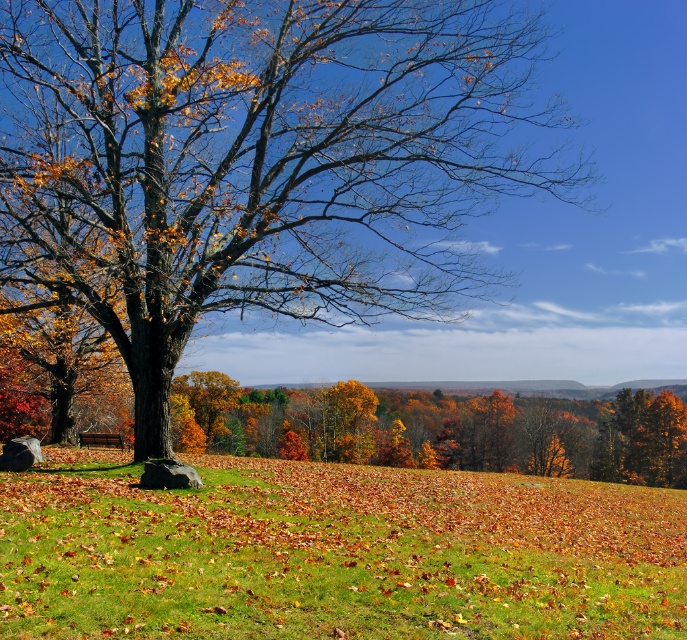
You are planning to set up a picnic in this autumn landscape. You have a picnic blanket that is 2 meters wide. The green grassy field at center is where you want to place it. Considering the matte brown tree at center, will the tree interfere with spreading the blanket fully?

The matte brown tree at center has a larger size compared to the green grassy field at center. Since the tree is larger, it might occupy more space, potentially limiting the area available for spreading the 2m wide picnic blanket. Check the tree canopy and trunk placement before deciding.

You are standing at the edge of a green grassy field at center and want to take a photo of the matte brown tree at center. Which direction should you face to capture both the tree and the field in your shot?

You should face to the right of the matte brown tree at center because the matte brown tree at center is to the left of green grassy field at center, so facing right would include both in the frame.

You are standing at the center of the image and want to walk towards the matte brown tree at center. In which direction should you move relative to your current position?

Since the matte brown tree at center is located at point [254,163], you should move towards the left and slightly downward from your current position at the center to reach it.